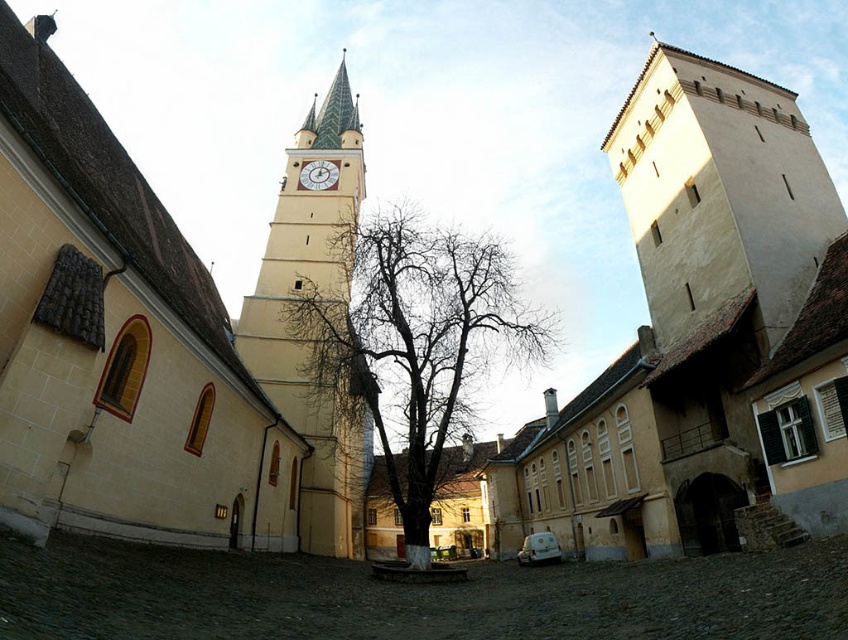
You are an architect analyzing the proportions of the buildings in the historic town square. Which object between the matte yellow church tower at upper center and the bare branches at center appears to be larger in the image?

The bare branches at center are larger than the matte yellow church tower at upper center in the image.

You are a tourist standing in the town square and want to take a photo that includes both the beige stone tower at right and the bare branches at center. Based on their positions, which object should you position closer to the bottom of your camera frame?

The beige stone tower at right is located below the bare branches at center, so to include both in the photo, you should position the beige stone tower at right closer to the bottom of your camera frame.